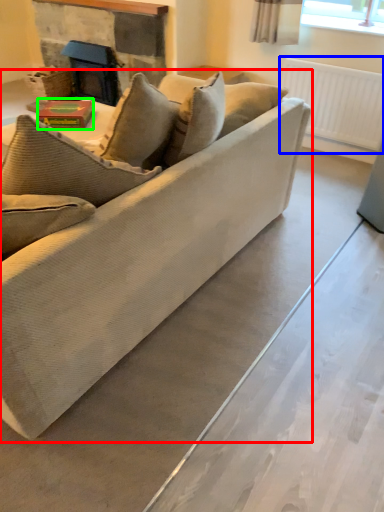
Question: Based on their relative distances, which object is farther from studio couch (highlighted by a red box)? Choose from radiator (highlighted by a blue box) and book (highlighted by a green box).

Choices:
 (A) radiator
 (B) book

Answer: (A)